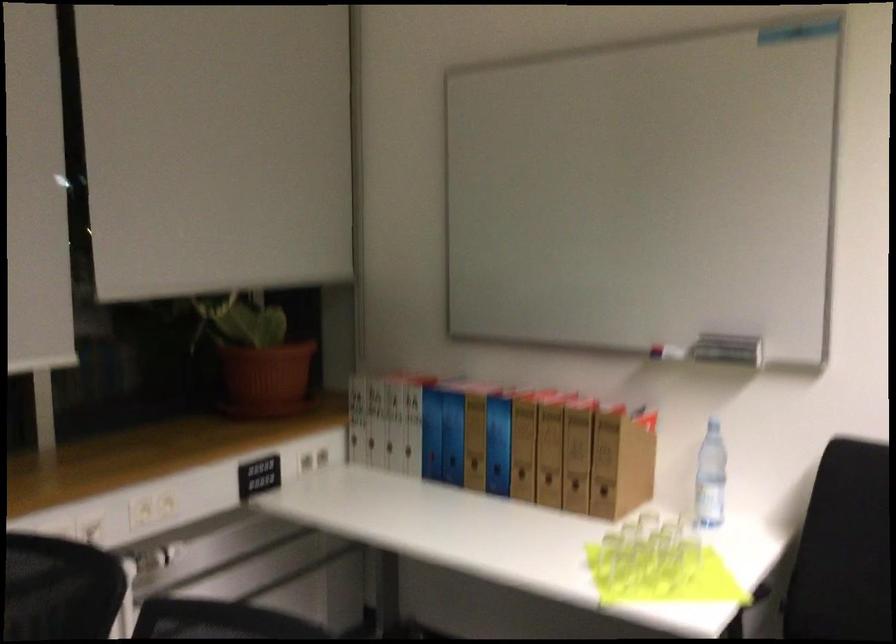
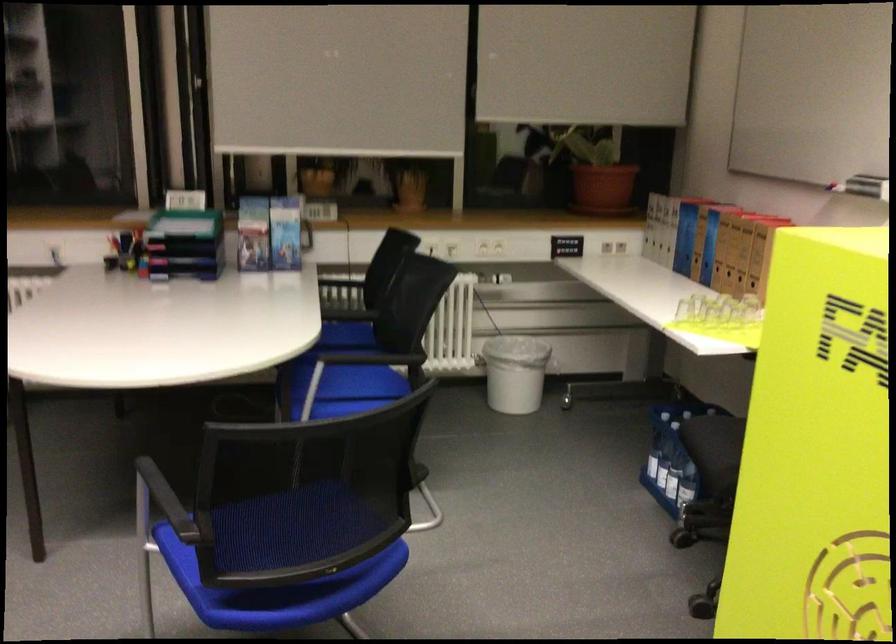
The point at (546, 453) is marked in the first image. Where is the corresponding point in the second image?

(730, 251)